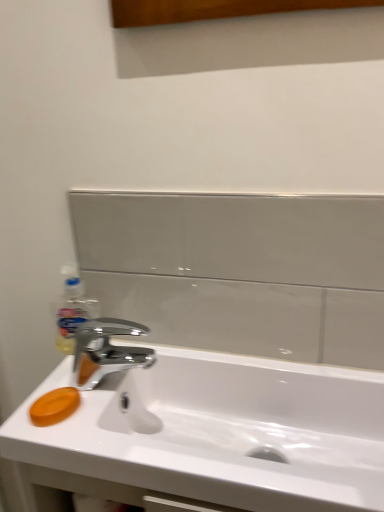
Question: From a real-world perspective, is chrome metallic faucet at center physically above orange matte soap at lower left?

Choices:
 (A) no
 (B) yes

Answer: (B)

Question: Is chrome metallic faucet at center wider than orange matte soap at lower left?

Choices:
 (A) yes
 (B) no

Answer: (A)

Question: Is chrome metallic faucet at center at the right side of orange matte soap at lower left?

Choices:
 (A) no
 (B) yes

Answer: (B)

Question: Is chrome metallic faucet at center oriented towards orange matte soap at lower left?

Choices:
 (A) yes
 (B) no

Answer: (B)

Question: From a real-world perspective, does chrome metallic faucet at center sit lower than orange matte soap at lower left?

Choices:
 (A) yes
 (B) no

Answer: (B)

Question: From the image's perspective, does chrome metallic faucet at center appear lower than orange matte soap at lower left?

Choices:
 (A) yes
 (B) no

Answer: (B)

Question: Is translucent plastic soap dispenser at left wider than orange matte soap at lower left?

Choices:
 (A) yes
 (B) no

Answer: (B)

Question: From the image's perspective, would you say translucent plastic soap dispenser at left is shown under orange matte soap at lower left?

Choices:
 (A) no
 (B) yes

Answer: (A)

Question: Is translucent plastic soap dispenser at left at the left side of orange matte soap at lower left?

Choices:
 (A) yes
 (B) no

Answer: (A)

Question: Does translucent plastic soap dispenser at left have a greater height compared to orange matte soap at lower left?

Choices:
 (A) yes
 (B) no

Answer: (A)

Question: From a real-world perspective, is translucent plastic soap dispenser at left under orange matte soap at lower left?

Choices:
 (A) no
 (B) yes

Answer: (A)

Question: Does translucent plastic soap dispenser at left have a larger size compared to orange matte soap at lower left?

Choices:
 (A) yes
 (B) no

Answer: (A)

Question: From the image's perspective, is translucent plastic soap dispenser at left on chrome metallic faucet at center?

Choices:
 (A) no
 (B) yes

Answer: (B)